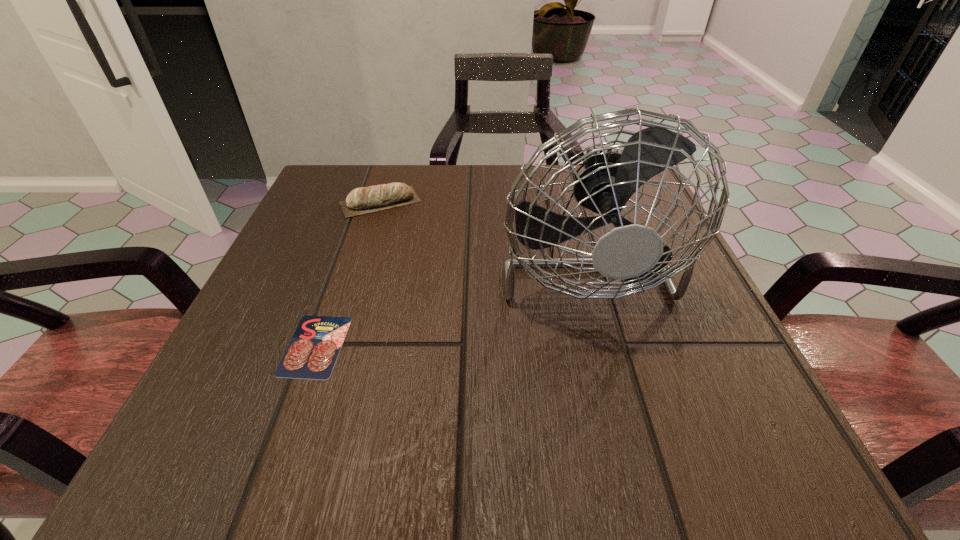
Locate an element on the screen. free spot between the second tallest object and the salami is located at coordinates (348, 274).

Where is `unoccupied position between the second shortest object and the salami`? The width and height of the screenshot is (960, 540). unoccupied position between the second shortest object and the salami is located at coordinates (348, 274).

Identify the location of vacant space in between the salami and the fan. Image resolution: width=960 pixels, height=540 pixels. (447, 301).

In order to click on vacant space in between the pita bread and the rightmost object in this screenshot , I will do `click(480, 230)`.

In order to click on vacant point located between the second tallest object and the salami in this screenshot , I will do `click(348, 274)`.

Locate an element on the screen. This screenshot has height=540, width=960. vacant area that lies between the salami and the second shortest object is located at coordinates (348, 274).

Find the location of a particular element. free space between the salami and the fan is located at coordinates (447, 301).

Where is `vacant space that is in between the shortest object and the tallest object`? vacant space that is in between the shortest object and the tallest object is located at coordinates (447, 301).

What are the coordinates of `unoccupied area between the tallest object and the shortest object` in the screenshot? It's located at (447, 301).

Find the location of a particular element. This screenshot has height=540, width=960. empty space that is in between the salami and the second shortest object is located at coordinates (348, 274).